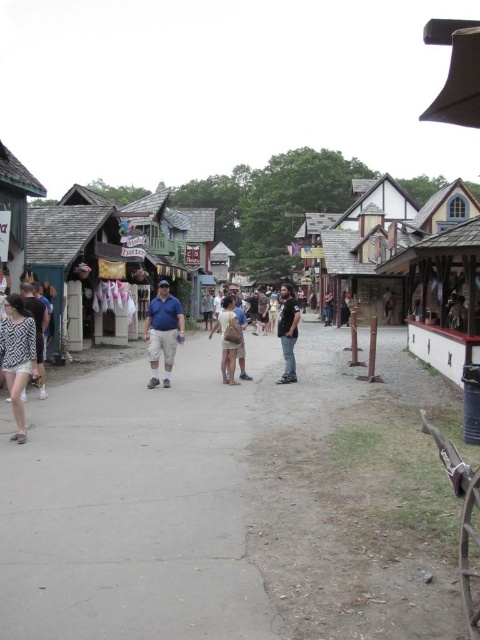
Is matte blue shirt at center to the right of black cotton shirt at center from the viewer's perspective?

Incorrect, matte blue shirt at center is not on the right side of black cotton shirt at center.

Is matte blue shirt at center above black cotton shirt at center?

No, matte blue shirt at center is not above black cotton shirt at center.

What do you see at coordinates (163, 332) in the screenshot? This screenshot has width=480, height=640. I see `matte blue shirt at center` at bounding box center [163, 332].

Locate an element on the screen. The height and width of the screenshot is (640, 480). matte blue shirt at center is located at coordinates (163, 332).

Which is more to the right, patterned fabric shorts at lower left or black cotton shirt at center?

Positioned to the right is black cotton shirt at center.

Is patterned fabric shorts at lower left bigger than black cotton shirt at center?

No.

Does point (4, 368) come in front of point (291, 339)?

Yes, it is in front of point (291, 339).

This screenshot has height=640, width=480. Identify the location of patterned fabric shorts at lower left. pyautogui.click(x=17, y=356).

The width and height of the screenshot is (480, 640). What do you see at coordinates (17, 356) in the screenshot?
I see `patterned fabric shorts at lower left` at bounding box center [17, 356].

Is point (16, 406) farther from camera compared to point (226, 336)?

No, (16, 406) is closer to viewer.

What are the coordinates of `patterned fabric shorts at lower left` in the screenshot? It's located at (17, 356).